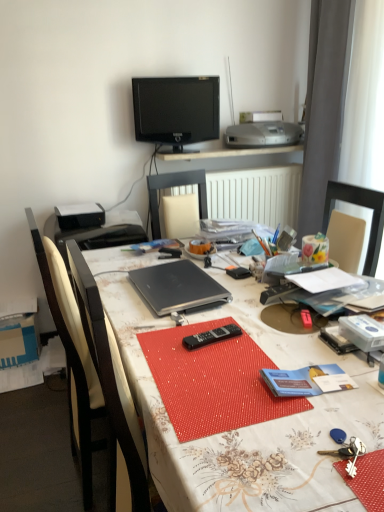
Where is `empty space that is ontop of matte black laptop at center`? empty space that is ontop of matte black laptop at center is located at coordinates (239, 317).